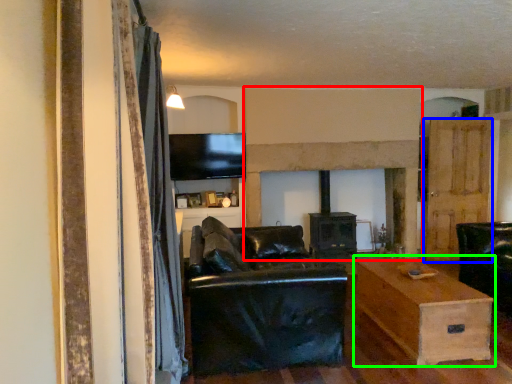
Question: Which object is the closest to the fireplace (highlighted by a red box)? Choose among these: door (highlighted by a blue box) or table (highlighted by a green box).

Choices:
 (A) door
 (B) table

Answer: (A)